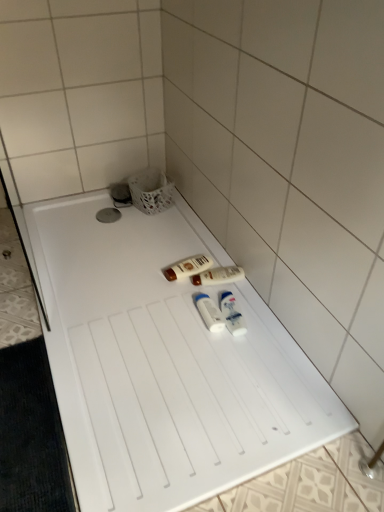
Identify the location of vacant space in front of white glossy lotion at center, acting as the second toiletry starting from the back. This screenshot has height=512, width=384. (200, 327).